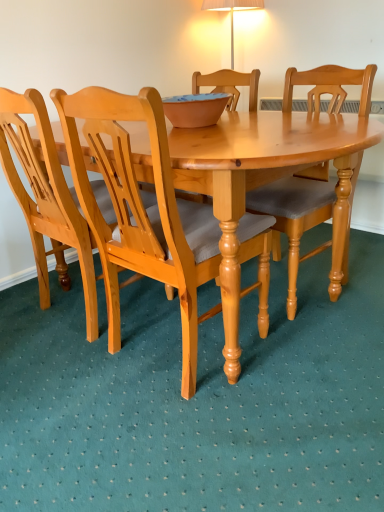
Question: Is light brown wood chair at left, the first chair in the left-to-right sequence, completely or partially inside light brown wood chair at center, the second chair in the left-to-right sequence?

Choices:
 (A) yes
 (B) no

Answer: (B)

Question: From the image's perspective, is light brown wood chair at center, which is the 2th chair from right to left, above light brown wood chair at left, placed as the 3th chair when sorted from right to left?

Choices:
 (A) yes
 (B) no

Answer: (B)

Question: From a real-world perspective, is light brown wood chair at center, which is the 2th chair from right to left, on top of light brown wood chair at left, the first chair in the left-to-right sequence?

Choices:
 (A) yes
 (B) no

Answer: (B)

Question: Is light brown wood chair at center, which is the 2th chair from right to left, facing away from light brown wood chair at left, placed as the 3th chair when sorted from right to left?

Choices:
 (A) yes
 (B) no

Answer: (B)

Question: Does light brown wood chair at center, the second chair in the left-to-right sequence, have a smaller size compared to light brown wood chair at left, the first chair in the left-to-right sequence?

Choices:
 (A) yes
 (B) no

Answer: (B)

Question: In terms of width, does light brown wood chair at center, which is counted as the first chair, starting from the right, look wider or thinner when compared to light brown wood chair at left, placed as the 3th chair when sorted from right to left?

Choices:
 (A) wide
 (B) thin

Answer: (A)

Question: In the image, is light brown wood chair at center, marked as the third chair in a left-to-right arrangement, positioned in front of or behind light brown wood chair at left, the first chair in the left-to-right sequence?

Choices:
 (A) front
 (B) behind

Answer: (B)

Question: Is point (274, 206) closer or farther from the camera than point (89, 250)?

Choices:
 (A) closer
 (B) farther

Answer: (B)

Question: Considering the positions of light brown wood chair at center, marked as the third chair in a left-to-right arrangement, and light brown wood chair at left, the first chair in the left-to-right sequence, in the image, is light brown wood chair at center, marked as the third chair in a left-to-right arrangement, bigger or smaller than light brown wood chair at left, the first chair in the left-to-right sequence,?

Choices:
 (A) big
 (B) small

Answer: (B)

Question: Considering the positions of point (163, 145) and point (82, 264), is point (163, 145) closer or farther from the camera than point (82, 264)?

Choices:
 (A) farther
 (B) closer

Answer: (B)

Question: Which is correct: light brown wood chair at center, the second chair in the left-to-right sequence, is inside light brown wood chair at left, the first chair in the left-to-right sequence, or outside of it?

Choices:
 (A) outside
 (B) inside

Answer: (A)

Question: Based on their sizes in the image, would you say light brown wood chair at center, which is the 2th chair from right to left, is bigger or smaller than light brown wood chair at left, the first chair in the left-to-right sequence?

Choices:
 (A) big
 (B) small

Answer: (A)

Question: Looking at their shapes, would you say light brown wood chair at center, which is the 2th chair from right to left, is wider or thinner than light brown wood chair at left, placed as the 3th chair when sorted from right to left?

Choices:
 (A) wide
 (B) thin

Answer: (A)

Question: Would you say light brown wood chair at center, marked as the third chair in a left-to-right arrangement, is to the left or to the right of light brown wood chair at center, the second chair in the left-to-right sequence, in the picture?

Choices:
 (A) right
 (B) left

Answer: (A)

Question: Is light brown wood chair at center, marked as the third chair in a left-to-right arrangement, bigger or smaller than light brown wood chair at center, the second chair in the left-to-right sequence?

Choices:
 (A) small
 (B) big

Answer: (A)